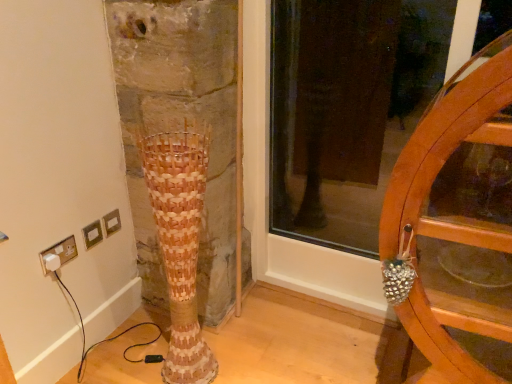
Describe the element at coordinates (451, 220) in the screenshot. The height and width of the screenshot is (384, 512). I see `wooden wheel at right` at that location.

This screenshot has width=512, height=384. I want to click on white plastic plug at lower left, so click(60, 252).

From the picture: Could you tell me if white plastic plug at lower left is turned towards woven wood vase at center?

Yes, white plastic plug at lower left is turned towards woven wood vase at center.

Is white plastic plug at lower left next to woven wood vase at center?

No, white plastic plug at lower left is not in contact with woven wood vase at center.

Considering the relative positions of white plastic plug at lower left and woven wood vase at center in the image provided, is white plastic plug at lower left to the left or to the right of woven wood vase at center?

Clearly, white plastic plug at lower left is on the left of woven wood vase at center in the image.

Which is correct: white plastic plug at lower left is inside woven wood vase at center, or outside of it?

white plastic plug at lower left exists outside the volume of woven wood vase at center.

Considering the relative sizes of wooden wheel at right and woven wood vase at center in the image provided, is wooden wheel at right taller than woven wood vase at center?

Correct, wooden wheel at right is much taller as woven wood vase at center.

Considering the sizes of wooden wheel at right and woven wood vase at center in the image, is wooden wheel at right wider or thinner than woven wood vase at center?

Considering their sizes, wooden wheel at right looks broader than woven wood vase at center.

Measure the distance from wooden wheel at right to woven wood vase at center.

wooden wheel at right and woven wood vase at center are 28.74 inches apart from each other.

Are wooden wheel at right and woven wood vase at center beside each other?

No, wooden wheel at right is not beside woven wood vase at center.

Can you tell me how much woven wood vase at center and wooden wheel at right differ in facing direction?

0.00337 degrees separate the facing orientations of woven wood vase at center and wooden wheel at right.

From the image's perspective, does woven wood vase at center appear higher than wooden wheel at right?

No, from the image's perspective, woven wood vase at center is not over wooden wheel at right.

Between woven wood vase at center and wooden wheel at right, which one is positioned behind?

Positioned behind is woven wood vase at center.

How many degrees apart are the facing directions of white plastic plug at lower left and wooden wheel at right?

The angle between the facing direction of white plastic plug at lower left and the facing direction of wooden wheel at right is 89.5 degrees.

From a real-world perspective, between white plastic plug at lower left and wooden wheel at right, who is vertically higher?

wooden wheel at right, from a real-world perspective.

Is wooden wheel at right completely or partially inside white plastic plug at lower left?

Definitely not — wooden wheel at right is not inside white plastic plug at lower left.

Is white plastic plug at lower left far from wooden wheel at right?

Absolutely, white plastic plug at lower left is distant from wooden wheel at right.

Locate an element on the screen. The image size is (512, 384). furniture on the right side of white plastic plug at lower left is located at coordinates (451, 220).

Is wooden wheel at right wider or thinner than white plastic plug at lower left?

Considering their sizes, wooden wheel at right looks broader than white plastic plug at lower left.

Which is more distant, (425,148) or (68,258)?

Point (68,258)

Which of these two, wooden wheel at right or white plastic plug at lower left, stands shorter?

white plastic plug at lower left.

Locate an element on the screen. tree trunk that appears above the white plastic plug at lower left (from a real-world perspective) is located at coordinates (180, 242).

In the scene shown: Could you tell me if woven wood vase at center is facing white plastic plug at lower left?

No, woven wood vase at center is not aimed at white plastic plug at lower left.

Considering the relative sizes of woven wood vase at center and white plastic plug at lower left in the image provided, is woven wood vase at center bigger than white plastic plug at lower left?

Correct, woven wood vase at center is larger in size than white plastic plug at lower left.

Between point (190, 263) and point (56, 253), which one is positioned behind?

Positioned behind is point (56, 253).

Identify the location of electric outlet that is behind the woven wood vase at center. (60, 252).

The height and width of the screenshot is (384, 512). I want to click on furniture located in front of the woven wood vase at center, so click(x=451, y=220).

From the image, which object appears to be farther from wooden wheel at right, woven wood vase at center or white plastic plug at lower left?

white plastic plug at lower left is further to wooden wheel at right.

Based on their spatial positions, is white plastic plug at lower left or wooden wheel at right further from woven wood vase at center?

wooden wheel at right is further to woven wood vase at center.

Estimate the real-world distances between objects in this image. Which object is closer to white plastic plug at lower left, woven wood vase at center or wooden wheel at right?

woven wood vase at center is positioned closer to the anchor white plastic plug at lower left.

Considering their positions, is wooden wheel at right positioned closer to white plastic plug at lower left than woven wood vase at center?

Among the two, woven wood vase at center is located nearer to white plastic plug at lower left.

From the image, which object appears to be nearer to wooden wheel at right, white plastic plug at lower left or woven wood vase at center?

woven wood vase at center is positioned closer to the anchor wooden wheel at right.

Considering their positions, is wooden wheel at right positioned closer to woven wood vase at center than white plastic plug at lower left?

white plastic plug at lower left.

The image size is (512, 384). What are the coordinates of `tree trunk between white plastic plug at lower left and wooden wheel at right` in the screenshot? It's located at (180, 242).